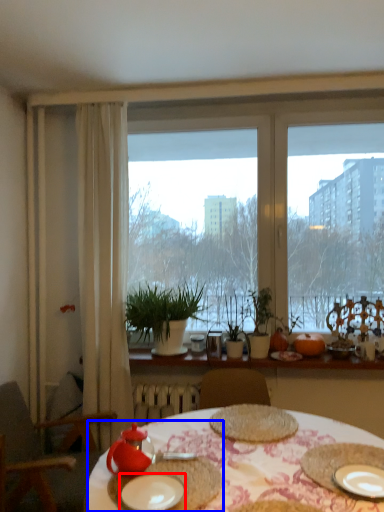
Question: Which object is closer to the camera taking this photo, plate (highlighted by a red box) or meal (highlighted by a blue box)?

Choices:
 (A) plate
 (B) meal

Answer: (A)